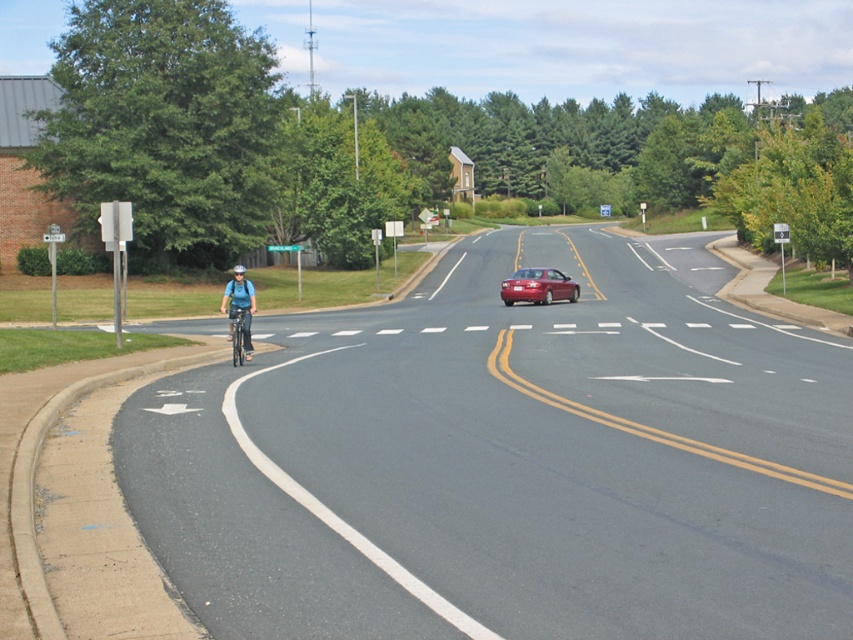
Is silver metallic bicycle at left bigger than matte blue helmet at center?

Incorrect, silver metallic bicycle at left is not larger than matte blue helmet at center.

In the scene shown: Who is more forward, (241, 324) or (236, 264)?

Point (241, 324) is more forward.

Locate an element on the screen. silver metallic bicycle at left is located at coordinates (239, 333).

Can you confirm if shiny red sedan at center is wider than silver metallic bicycle at left?

No.

Does shiny red sedan at center appear over silver metallic bicycle at left?

Yes, shiny red sedan at center is above silver metallic bicycle at left.

Is point (554, 296) less distant than point (228, 316)?

No, (554, 296) is further to viewer.

Image resolution: width=853 pixels, height=640 pixels. I want to click on shiny red sedan at center, so click(538, 285).

Between black asphalt bike lane at left and matte blue helmet at center, which one appears on the right side from the viewer's perspective?

From the viewer's perspective, black asphalt bike lane at left appears more on the right side.

Is black asphalt bike lane at left to the left of matte blue helmet at center from the viewer's perspective?

No, black asphalt bike lane at left is not to the left of matte blue helmet at center.

Which is behind, point (401, 508) or point (234, 269)?

Positioned behind is point (234, 269).

Identify the location of black asphalt bike lane at left. (512, 458).